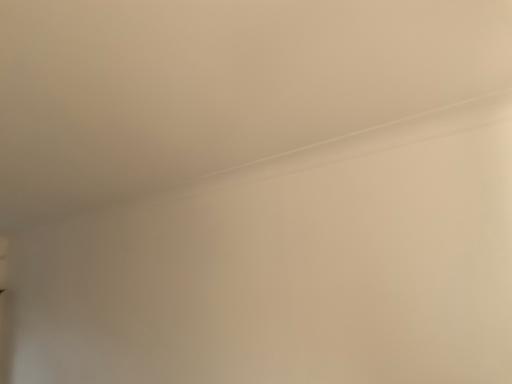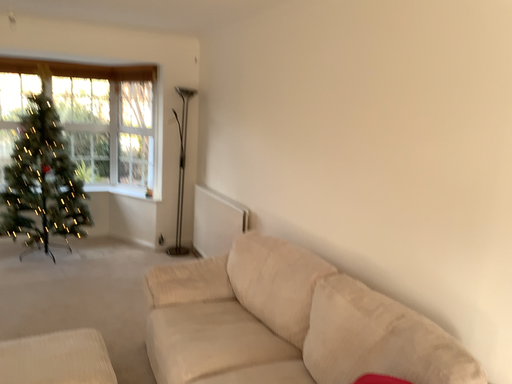
Question: How did the camera likely rotate when shooting the video?

Choices:
 (A) rotated right
 (B) rotated left

Answer: (B)